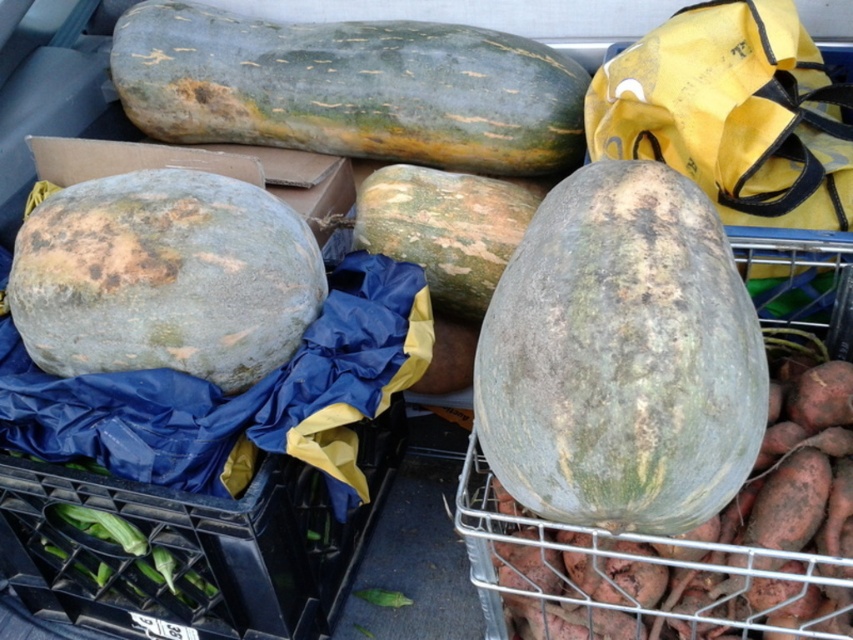
You are a delivery person who needs to load a green rough squash at left into a delivery truck. The truck has a loading dock at coordinates 0.5, 0.2. Which direction should you move the squash to reach the loading dock?

The green rough squash at left is at point (164, 276). The loading dock is at (170, 320). To reach the loading dock, you should move the squash slightly to the right and upward.